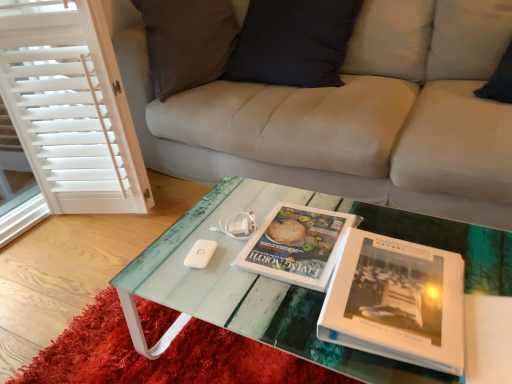
At what (x,y) coordinates should I click in order to perform the action: click on blank space situated above matte white book at center, the first book positioned from the back (from a real-world perspective). Please return your answer as a coordinate pair (x, y). Looking at the image, I should click on (301, 231).